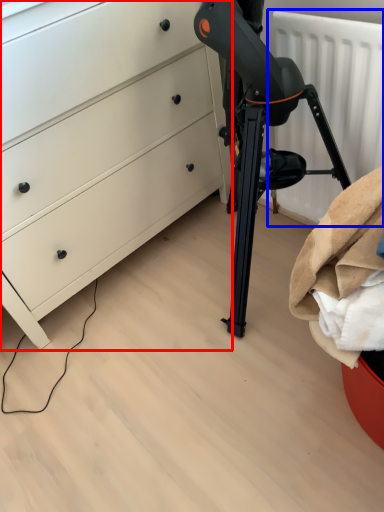
Question: Which object appears closest to the camera in this image, chest of drawers (highlighted by a red box) or radiator (highlighted by a blue box)?

Choices:
 (A) chest of drawers
 (B) radiator

Answer: (A)